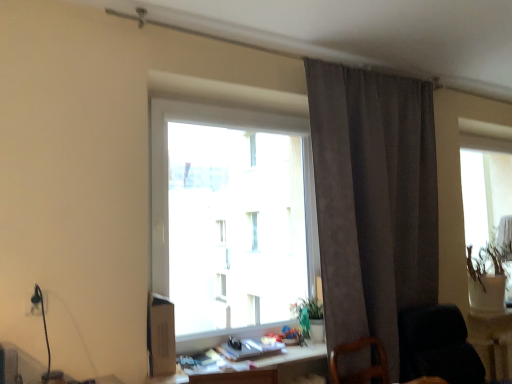
Measure the distance between wooden desk at lower center, which is counted as the second table, starting from the right, and camera.

They are 1.96 meters apart.

This screenshot has height=384, width=512. I want to click on transparent glass window at center, so click(229, 218).

What is the approximate width of transparent glass window at center?

9.39 inches.

You are a GUI agent. You are given a task and a screenshot of the screen. Output one action in this format:
    pyautogui.click(x=<x>, y=<y>)
    Task: Click on the wooden table at lower right, marked as the first table in a right-to-left arrangement
    Image resolution: width=512 pixels, height=384 pixels.
    Given the screenshot: What is the action you would take?
    pyautogui.click(x=492, y=342)

From the picture: Is transparent glass window at center to the left or to the right of wooden table at lower right, the 1th table when ordered from back to front, in the image?

Clearly, transparent glass window at center is on the left of wooden table at lower right, the 1th table when ordered from back to front, in the image.

Which object is wider, transparent glass window at center or wooden table at lower right, which is the second table in left-to-right order?

transparent glass window at center.

Consider the image. Is transparent glass window at center looking in the opposite direction of wooden table at lower right, marked as the first table in a right-to-left arrangement?

No, wooden table at lower right, marked as the first table in a right-to-left arrangement, is not at the back of transparent glass window at center.

Considering the relative sizes of wooden table at lower right, the first table ordered from the bottom, and green matte vase at right in the image provided, is wooden table at lower right, the first table ordered from the bottom, wider than green matte vase at right?

No.

Can you confirm if wooden table at lower right, which is the second table in left-to-right order, is positioned to the right of green matte vase at right?

Indeed, wooden table at lower right, which is the second table in left-to-right order, is positioned on the right side of green matte vase at right.

Which is behind, wooden table at lower right, which is the second table in top-to-bottom order, or green matte vase at right?

green matte vase at right.

From the image's perspective, is wooden table at lower right, the first table ordered from the bottom, on top of green matte vase at right?

Incorrect, from the image's perspective, wooden table at lower right, the first table ordered from the bottom, is lower than green matte vase at right.

From a real-world perspective, which is physically below, green matte vase at right or wooden desk at lower center, marked as the 2th table in a back-to-front arrangement?

From a 3D spatial view, wooden desk at lower center, marked as the 2th table in a back-to-front arrangement, is below.

Is green matte vase at right far away from wooden desk at lower center, which is the 1th table in top-to-bottom order?

Yes, green matte vase at right and wooden desk at lower center, which is the 1th table in top-to-bottom order, are quite far apart.

Is green matte vase at right not inside wooden desk at lower center, marked as the 2th table in a back-to-front arrangement?

Yes.

Which of these two, green matte vase at right or wooden desk at lower center, marked as the 2th table in a back-to-front arrangement, is smaller?

With smaller size is wooden desk at lower center, marked as the 2th table in a back-to-front arrangement.

At what (x,y) coordinates should I click in order to perform the action: click on table that is the 2nd one when counting downward from the transparent glass window at center (from the image's perspective). Please return your answer as a coordinate pair (x, y). The image size is (512, 384). Looking at the image, I should click on (492, 342).

From the image's perspective, which one is positioned lower, wooden table at lower right, the second table in the front-to-back sequence, or transparent glass window at center?

wooden table at lower right, the second table in the front-to-back sequence, from the image's perspective.

Is wooden table at lower right, marked as the first table in a right-to-left arrangement, next to transparent glass window at center?

No, wooden table at lower right, marked as the first table in a right-to-left arrangement, is not beside transparent glass window at center.

Is wooden table at lower right, which is the second table in left-to-right order, positioned with its back to transparent glass window at center?

No, transparent glass window at center is not at the back of wooden table at lower right, which is the second table in left-to-right order.

What's the angular difference between wooden desk at lower center, arranged as the first table when viewed from the left, and wooden table at lower right, the first table ordered from the bottom,'s facing directions?

The angle between the facing direction of wooden desk at lower center, arranged as the first table when viewed from the left, and the facing direction of wooden table at lower right, the first table ordered from the bottom, is 0.852 degrees.

Considering the relative sizes of wooden desk at lower center, arranged as the first table when viewed from the left, and wooden table at lower right, the first table ordered from the bottom, in the image provided, is wooden desk at lower center, arranged as the first table when viewed from the left, shorter than wooden table at lower right, the first table ordered from the bottom,?

Yes, wooden desk at lower center, arranged as the first table when viewed from the left, is shorter than wooden table at lower right, the first table ordered from the bottom.

Which object is closer to the camera taking this photo, wooden desk at lower center, marked as the 2th table in a back-to-front arrangement, or wooden table at lower right, the first table ordered from the bottom?

wooden desk at lower center, marked as the 2th table in a back-to-front arrangement, is in front.

How different are the orientations of suede-like gray curtain at upper right and green matte vase at right in degrees?

They differ by 1.05 degrees in their facing directions.

Looking at this image, would you consider suede-like gray curtain at upper right to be distant from green matte vase at right?

Indeed, suede-like gray curtain at upper right is not near green matte vase at right.

Find the location of a particular element. The height and width of the screenshot is (384, 512). curtain located on the left of green matte vase at right is located at coordinates coord(373,200).

What are the coordinates of `rocking chair below the green matte vase at right (from a real-world perspective)` in the screenshot? It's located at (437, 346).

How different are the orientations of black fabric rocking chair at lower right and green matte vase at right in degrees?

2.46 degrees.

Is black fabric rocking chair at lower right taller than green matte vase at right?

No, black fabric rocking chair at lower right is not taller than green matte vase at right.

From a real-world perspective, starting from the transparent glass window at center, which table is the 2nd one below it? Please provide its 2D coordinates.

[(492, 342)]

Find the location of a particular element. This screenshot has height=384, width=512. plant that appears behind the wooden table at lower right, the first table ordered from the bottom is located at coordinates (492, 254).

Based on their spatial positions, is wooden table at lower right, which is the second table in top-to-bottom order, or wooden desk at lower center, marked as the 2th table in a back-to-front arrangement, closer to transparent glass window at center?

wooden desk at lower center, marked as the 2th table in a back-to-front arrangement.

Considering their positions, is transparent glass window at center positioned closer to green matte vase at right than black fabric rocking chair at lower right?

black fabric rocking chair at lower right is closer to green matte vase at right.

Based on their spatial positions, is transparent glass window at center or wooden table at lower right, which is the second table in top-to-bottom order, closer to green matte vase at right?

wooden table at lower right, which is the second table in top-to-bottom order, is closer to green matte vase at right.

When comparing their distances from suede-like gray curtain at upper right, does green matte vase at right or wooden table at lower right, the first table ordered from the bottom, seem closer?

wooden table at lower right, the first table ordered from the bottom, is positioned closer to the anchor suede-like gray curtain at upper right.

Based on their spatial positions, is black fabric rocking chair at lower right or transparent glass window at center closer to wooden desk at lower center, arranged as the first table when viewed from the left?

The object closer to wooden desk at lower center, arranged as the first table when viewed from the left, is black fabric rocking chair at lower right.

Considering their positions, is wooden desk at lower center, the first table from the front, positioned further to transparent glass window at center than black fabric rocking chair at lower right?

black fabric rocking chair at lower right is positioned further to the anchor transparent glass window at center.

From the image, which object appears to be nearer to suede-like gray curtain at upper right, green matte vase at right or black fabric rocking chair at lower right?

Based on the image, black fabric rocking chair at lower right appears to be nearer to suede-like gray curtain at upper right.

Based on their spatial positions, is suede-like gray curtain at upper right or wooden desk at lower center, marked as the 2th table in a back-to-front arrangement, further from green matte vase at right?

Based on the image, wooden desk at lower center, marked as the 2th table in a back-to-front arrangement, appears to be further to green matte vase at right.

Identify the location of curtain between wooden desk at lower center, which is the 1th table in top-to-bottom order, and black fabric rocking chair at lower right. The width and height of the screenshot is (512, 384). (x=373, y=200).

At what (x,y) coordinates should I click in order to perform the action: click on curtain situated between wooden desk at lower center, acting as the second table starting from the bottom, and green matte vase at right from left to right. Please return your answer as a coordinate pair (x, y). Looking at the image, I should click on (373, 200).

At what (x,y) coordinates should I click in order to perform the action: click on rocking chair situated between wooden desk at lower center, which is the 1th table in top-to-bottom order, and wooden table at lower right, the second table in the front-to-back sequence, from left to right. Please return your answer as a coordinate pair (x, y). Looking at the image, I should click on (437, 346).

In order to click on plant located between suede-like gray curtain at upper right and wooden table at lower right, the second table in the front-to-back sequence, in the left-right direction in this screenshot , I will do `click(492, 254)`.